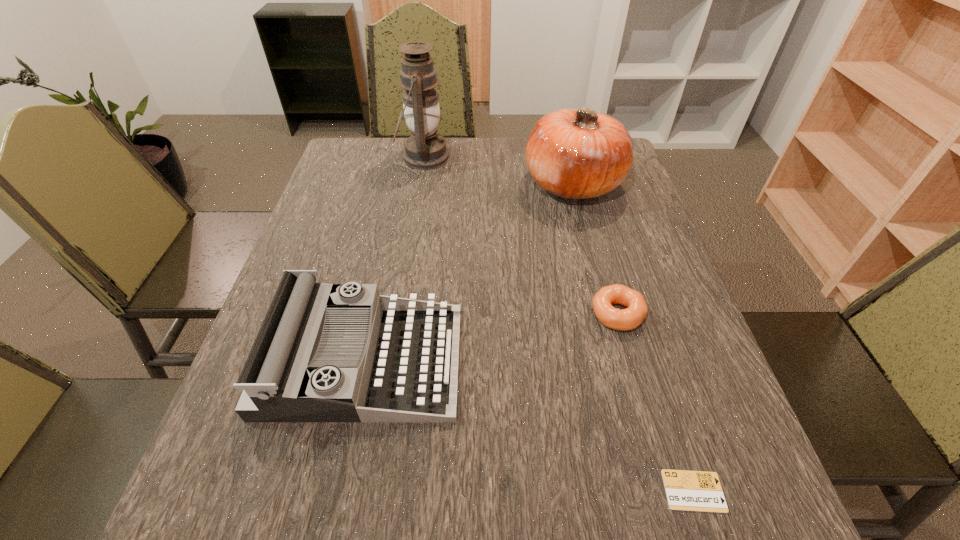
Image resolution: width=960 pixels, height=540 pixels. What are the coordinates of `oil lamp` in the screenshot? It's located at (425, 149).

Locate an element on the screen. pumpkin is located at coordinates (579, 153).

This screenshot has height=540, width=960. I want to click on the third shortest object, so click(x=325, y=352).

At what (x,y) coordinates should I click in order to perform the action: click on doughnut. Please return your answer as a coordinate pair (x, y). Looking at the image, I should click on (626, 319).

This screenshot has width=960, height=540. What are the coordinates of `the shortest object` in the screenshot? It's located at (701, 491).

Image resolution: width=960 pixels, height=540 pixels. Identify the location of the nearest object. (701, 491).

At what (x,y) coordinates should I click in order to perform the action: click on vacant space situated on the front of the tallest object. Please return your answer as a coordinate pair (x, y). This screenshot has height=540, width=960. Looking at the image, I should click on (419, 186).

You are a GUI agent. You are given a task and a screenshot of the screen. Output one action in this format:
    pyautogui.click(x=<x>, y=<y>)
    Task: Click on the free space located 0.340m on the left of the pumpkin
    This screenshot has width=960, height=540.
    Given the screenshot: What is the action you would take?
    pyautogui.click(x=406, y=184)

Identify the location of vacant region located on the typing side of the typewriter. This screenshot has height=540, width=960. (570, 361).

This screenshot has height=540, width=960. What are the coordinates of `vacant space positioned on the front of the fourth tallest object` in the screenshot? It's located at (652, 438).